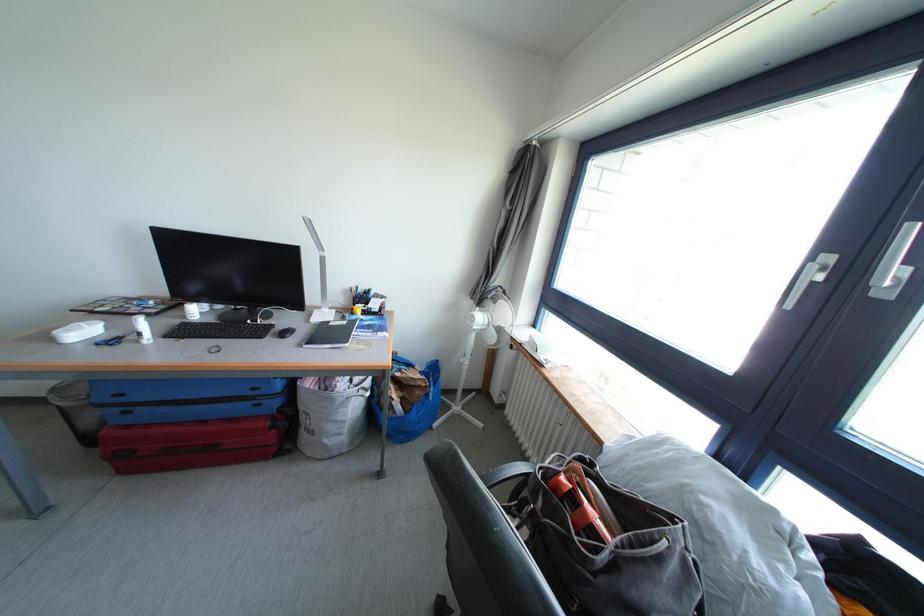
This screenshot has width=924, height=616. I want to click on red suitcase handle, so click(187, 440).